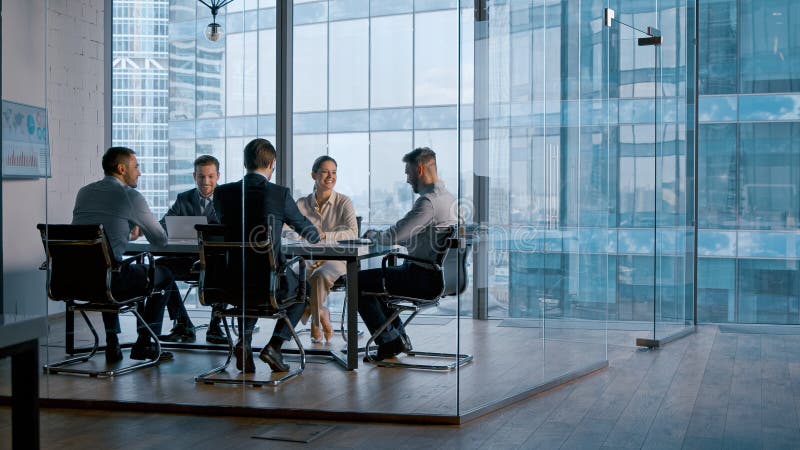
The height and width of the screenshot is (450, 800). I want to click on curved legs of office chairs, so click(96, 346), click(302, 356), click(228, 349), click(157, 352), click(342, 325), click(366, 347), click(404, 327).